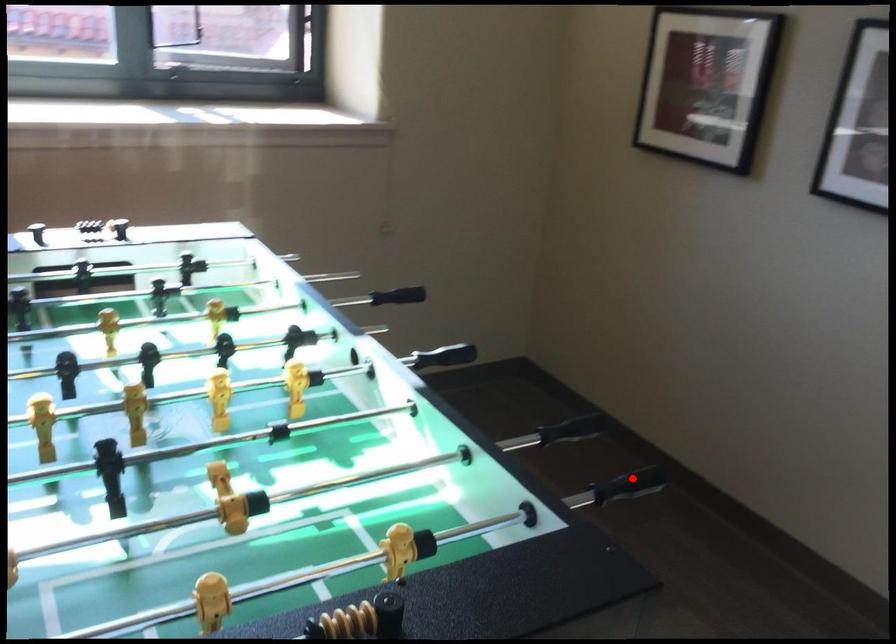
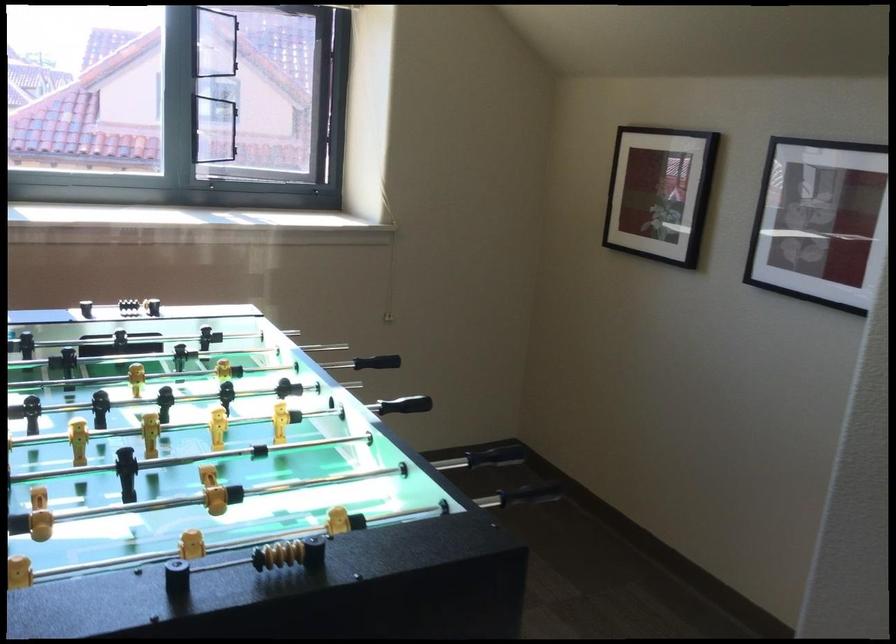
In the second image, find the point that corresponds to the highlighted location in the first image.

(531, 493)